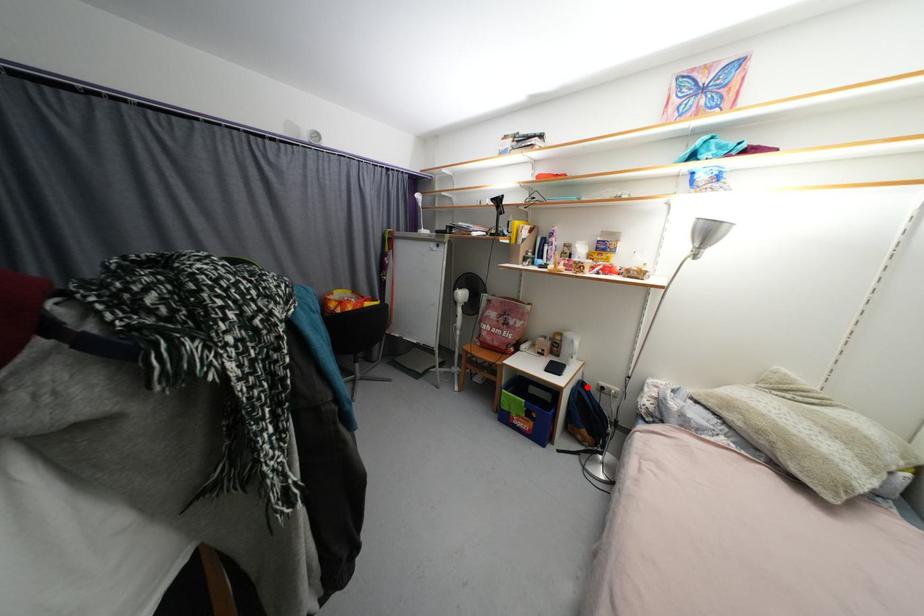
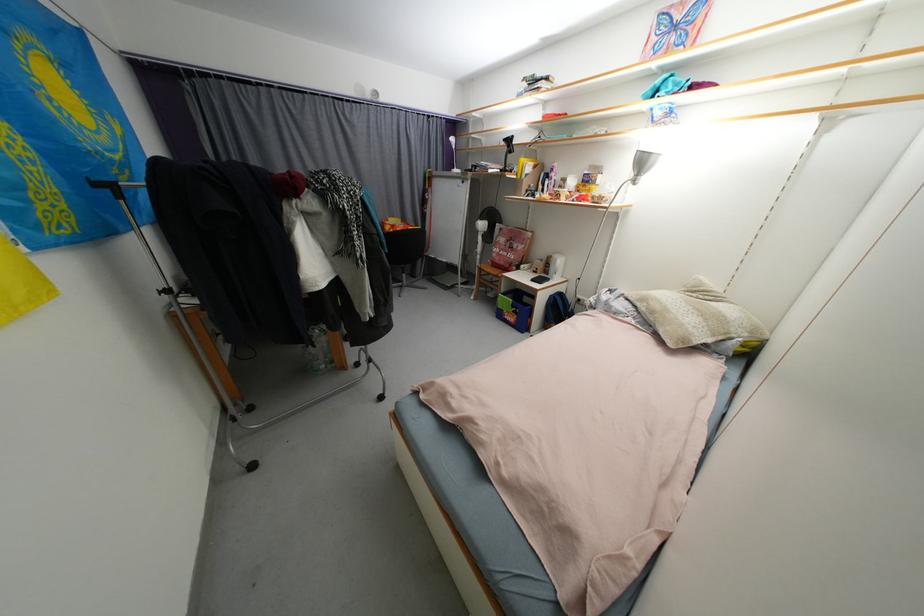
The point at the highlighted location is marked in the first image. Where is the corresponding point in the second image?

(565, 297)